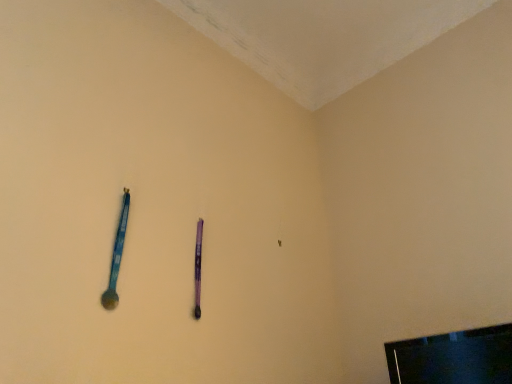
Question: Can you confirm if black glossy television at lower right is thinner than blue plastic spoon at left?

Choices:
 (A) yes
 (B) no

Answer: (B)

Question: Is black glossy television at lower right not near blue plastic spoon at left?

Choices:
 (A) no
 (B) yes

Answer: (B)

Question: Does black glossy television at lower right come behind blue plastic spoon at left?

Choices:
 (A) yes
 (B) no

Answer: (B)

Question: Is black glossy television at lower right located outside blue plastic spoon at left?

Choices:
 (A) yes
 (B) no

Answer: (A)

Question: Does black glossy television at lower right appear on the right side of blue plastic spoon at left?

Choices:
 (A) yes
 (B) no

Answer: (A)

Question: From a real-world perspective, is blue plastic spoon at left physically located above or below black glossy television at lower right?

Choices:
 (A) below
 (B) above

Answer: (B)

Question: Looking at their shapes, would you say blue plastic spoon at left is wider or thinner than black glossy television at lower right?

Choices:
 (A) thin
 (B) wide

Answer: (A)

Question: In the image, is blue plastic spoon at left on the left side or the right side of black glossy television at lower right?

Choices:
 (A) left
 (B) right

Answer: (A)

Question: Does point (125, 223) appear closer or farther from the camera than point (474, 342)?

Choices:
 (A) farther
 (B) closer

Answer: (A)

Question: Considering the positions of point (195, 251) and point (119, 240), is point (195, 251) closer or farther from the camera than point (119, 240)?

Choices:
 (A) farther
 (B) closer

Answer: (A)

Question: Is purple matte pen at center wider or thinner than blue plastic spoon at left?

Choices:
 (A) wide
 (B) thin

Answer: (B)

Question: From a real-world perspective, relative to blue plastic spoon at left, is purple matte pen at center vertically above or below?

Choices:
 (A) above
 (B) below

Answer: (B)

Question: In terms of height, does purple matte pen at center look taller or shorter compared to blue plastic spoon at left?

Choices:
 (A) tall
 (B) short

Answer: (B)

Question: Looking at the image, does black glossy television at lower right seem bigger or smaller compared to blue plastic spoon at left?

Choices:
 (A) big
 (B) small

Answer: (A)

Question: Based on their positions, is black glossy television at lower right located to the left or right of blue plastic spoon at left?

Choices:
 (A) right
 (B) left

Answer: (A)